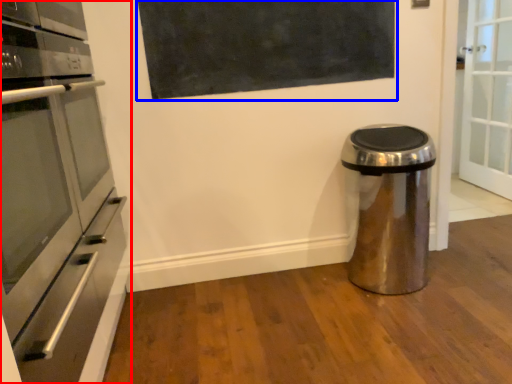
Question: Which object appears farthest to the camera in this image, home appliance (highlighted by a red box) or bulletin board (highlighted by a blue box)?

Choices:
 (A) home appliance
 (B) bulletin board

Answer: (B)